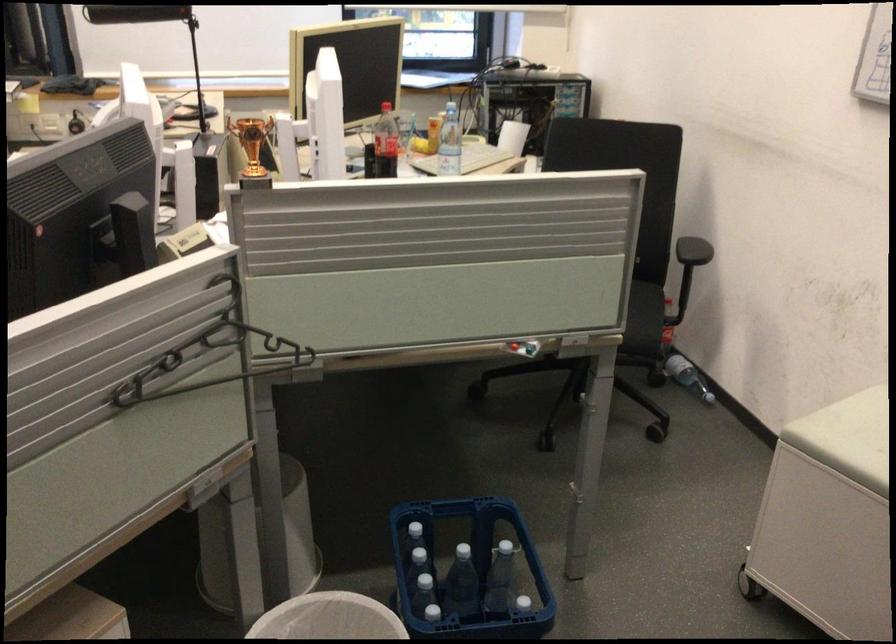
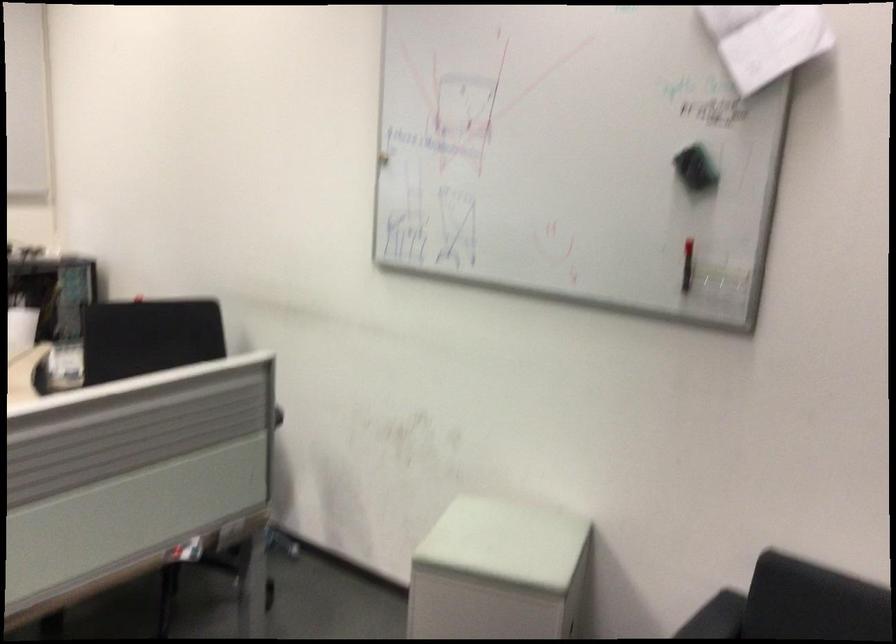
The point at (686, 377) is marked in the first image. Where is the corresponding point in the second image?

(264, 535)